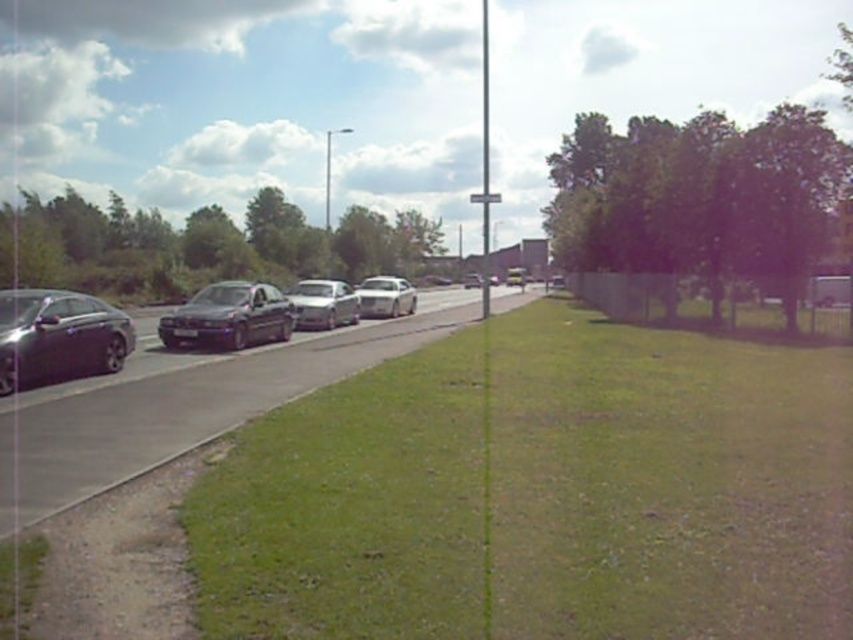
Question: Does satin black sedan at center have a greater width compared to satin silver sedan at center?

Choices:
 (A) yes
 (B) no

Answer: (A)

Question: Among these objects, which one is nearest to the camera?

Choices:
 (A) shiny black sedan at left
 (B) satin black sedan at center
 (C) white glossy car at center

Answer: (A)

Question: Does satin silver sedan at center appear on the right side of white glossy car at center?

Choices:
 (A) no
 (B) yes

Answer: (A)

Question: Which object appears farthest from the camera in this image?

Choices:
 (A) satin silver sedan at center
 (B) satin black sedan at center

Answer: (A)

Question: Which point is closer to the camera taking this photo?

Choices:
 (A) (74, 358)
 (B) (809, 560)
 (C) (387, 301)

Answer: (B)

Question: Does satin silver sedan at center appear on the right side of shiny silver sedan at center?

Choices:
 (A) yes
 (B) no

Answer: (B)